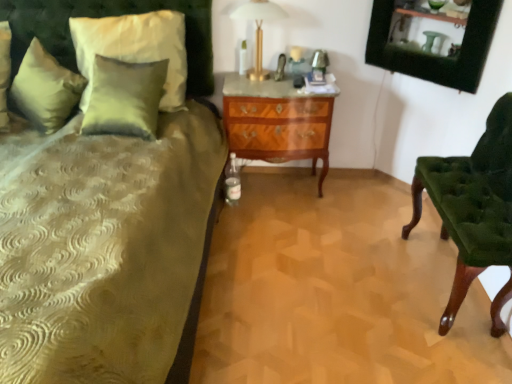
Identify the location of free spot to the right of mahogany wood drawer at center. The image size is (512, 384). (352, 194).